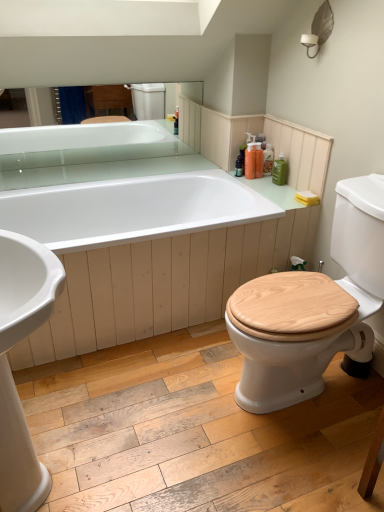
You are a GUI agent. You are given a task and a screenshot of the screen. Output one action in this format:
    pyautogui.click(x=<x>, y=<y>)
    Task: Click on the vacant space in front of translucent orange bottle at upper right, the third toiletry from the right
    This screenshot has height=512, width=384.
    Given the screenshot: What is the action you would take?
    pyautogui.click(x=265, y=179)